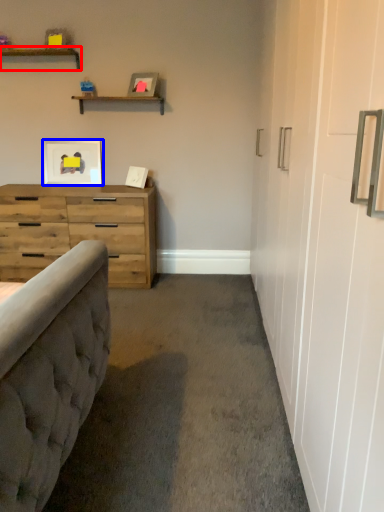
Question: Which of the following is the closest to the observer, shelf (highlighted by a red box) or picture frame (highlighted by a blue box)?

Choices:
 (A) shelf
 (B) picture frame

Answer: (A)